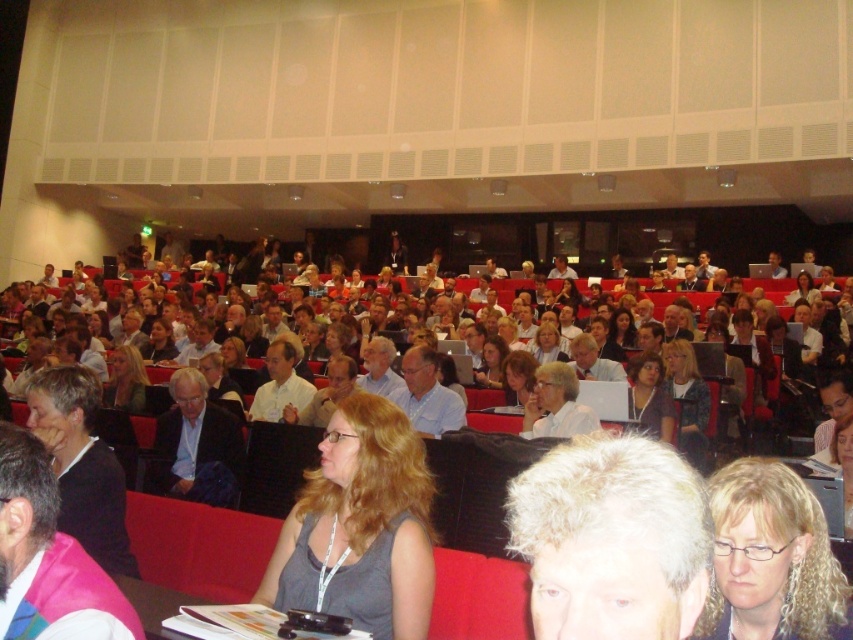
Question: Does blonde hair at center come in front of white glossy shirt at center?

Choices:
 (A) no
 (B) yes

Answer: (B)

Question: Which point is closer to the camera taking this photo?

Choices:
 (A) (799, 595)
 (B) (418, 596)
 (C) (582, 408)
 (D) (660, 515)

Answer: (D)

Question: Does gray curly hair at center appear on the right side of white glossy shirt at center?

Choices:
 (A) yes
 (B) no

Answer: (B)

Question: Which point is closer to the camera?

Choices:
 (A) (425, 568)
 (B) (544, 488)
 (C) (718, 582)
 (D) (537, 435)

Answer: (B)

Question: Does gray curly hair at center appear over white shirt at center?

Choices:
 (A) yes
 (B) no

Answer: (A)

Question: Which of the following is the farthest from the observer?

Choices:
 (A) click(624, 632)
 (B) click(397, 545)
 (C) click(285, 388)
 (D) click(779, 522)

Answer: (C)